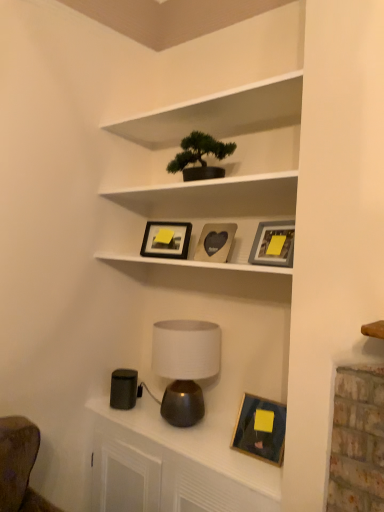
At what (x,y) coordinates should I click in order to perform the action: click on vacant region above metallic lamp at lower center (from a real-world perspective). Please return your answer as a coordinate pair (x, y). Looking at the image, I should click on (194, 434).